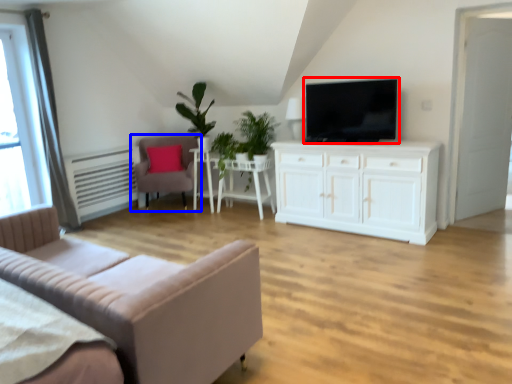
Question: Among these objects, which one is farthest to the camera, television (highlighted by a red box) or chair (highlighted by a blue box)?

Choices:
 (A) television
 (B) chair

Answer: (B)